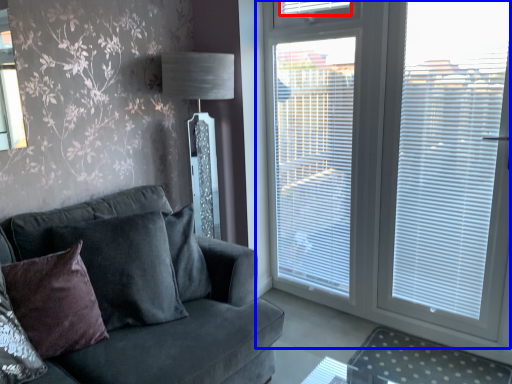
Question: Among these objects, which one is farthest to the camera, blind (highlighted by a red box) or window (highlighted by a blue box)?

Choices:
 (A) blind
 (B) window

Answer: (A)